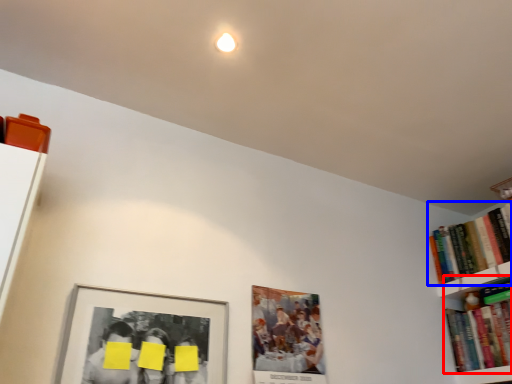
Question: Among these objects, which one is nearest to the camera, book (highlighted by a red box) or book (highlighted by a blue box)?

Choices:
 (A) book
 (B) book

Answer: (A)